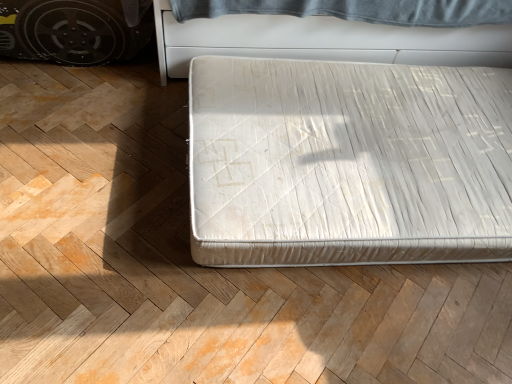
I want to click on blank space to the left of white fabric bed at center, so click(98, 174).